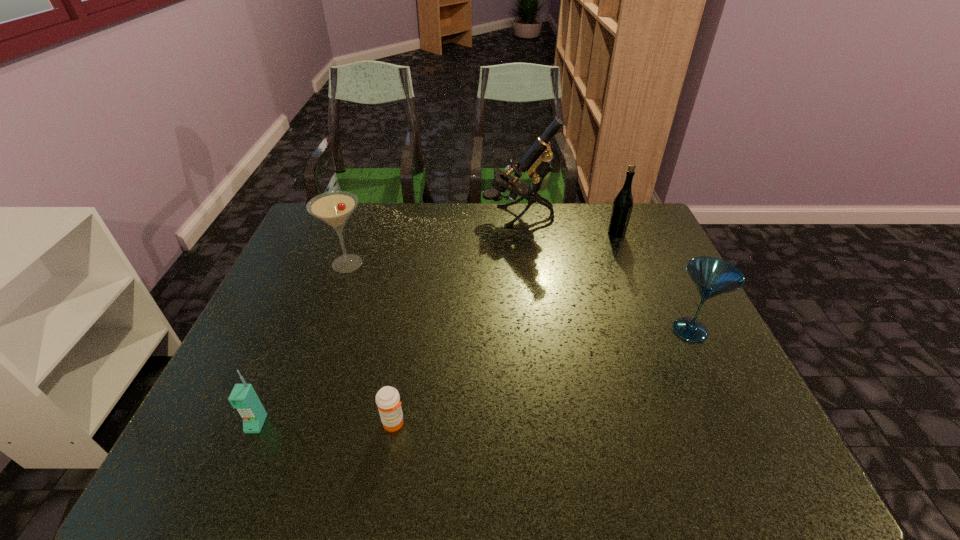
Locate an element on the screen. This screenshot has width=960, height=540. vacant region located 0.280m through the eyepiece of the microscope is located at coordinates click(x=401, y=217).

What are the coordinates of `free space located 0.200m through the eyepiece of the microscope` in the screenshot? It's located at (424, 217).

Where is `blank area located through the eyepiece of the microscope`? Image resolution: width=960 pixels, height=540 pixels. blank area located through the eyepiece of the microscope is located at coordinates (447, 217).

Where is `free space located 0.260m on the left of the fifth nearest object`? The width and height of the screenshot is (960, 540). free space located 0.260m on the left of the fifth nearest object is located at coordinates (528, 234).

You are a GUI agent. You are given a task and a screenshot of the screen. Output one action in this format:
    pyautogui.click(x=<x>, y=<y>)
    Task: Click on the vacant space located on the front of the farther martini
    The width and height of the screenshot is (960, 540).
    Given the screenshot: What is the action you would take?
    pyautogui.click(x=329, y=313)

I want to click on free region located on the back of the right martini, so click(640, 228).

Where is `free space located on the keypad of the second shortest object`? free space located on the keypad of the second shortest object is located at coordinates (240, 462).

Identify the location of vacant area situated 0.360m on the left of the fourth object from right to left. Image resolution: width=960 pixels, height=540 pixels. (211, 423).

Find the location of `microscope that is at the far edge`. microscope that is at the far edge is located at coordinates (536, 161).

Locate an element on the screen. beer bottle located in the far edge section of the desktop is located at coordinates (622, 207).